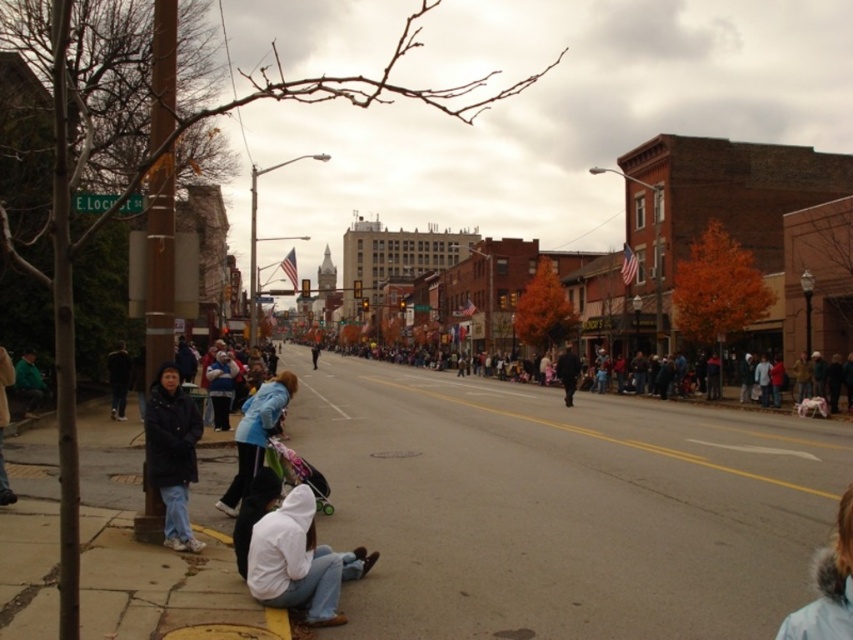
Question: Which is farther from the dark blue jacket at center?

Choices:
 (A) multicolored fabric crowd at center
 (B) white fleece jacket at lower center
 (C) green matte jacket at left

Answer: (A)

Question: Does multicolored fabric crowd at center have a smaller size compared to dark blue jacket at center?

Choices:
 (A) yes
 (B) no

Answer: (B)

Question: Can you confirm if gray concrete pavement at lower center is wider than light brown leather jacket at lower left?

Choices:
 (A) no
 (B) yes

Answer: (B)

Question: Which of the following is the closest to the observer?

Choices:
 (A) white fleece jacket at lower center
 (B) light blue jacket at lower left

Answer: (A)

Question: Can you confirm if light brown leather jacket at lower left is positioned below dark blue jacket at center?

Choices:
 (A) yes
 (B) no

Answer: (B)

Question: Which point is closer to the camera taking this photo?

Choices:
 (A) (117, 358)
 (B) (563, 380)

Answer: (A)